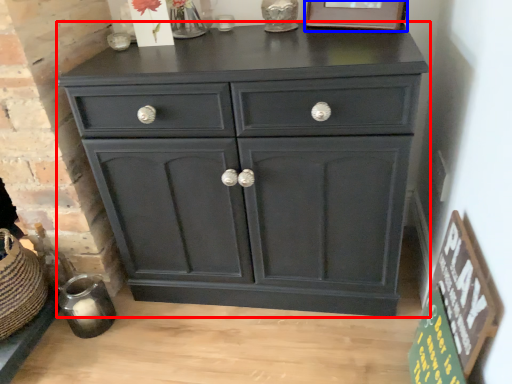
Question: Which object appears farthest to the camera in this image, chest of drawers (highlighted by a red box) or picture frame (highlighted by a blue box)?

Choices:
 (A) chest of drawers
 (B) picture frame

Answer: (B)